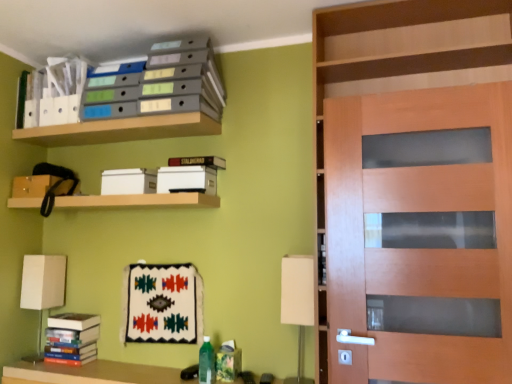
You are a GUI agent. You are given a task and a screenshot of the screen. Output one action in this format:
    pyautogui.click(x=<x>, y=<y>)
    Task: Click on the vacant area situated below white cardboard box at upper center (from a real-world perspective)
    
    Given the screenshot: What is the action you would take?
    pyautogui.click(x=122, y=193)